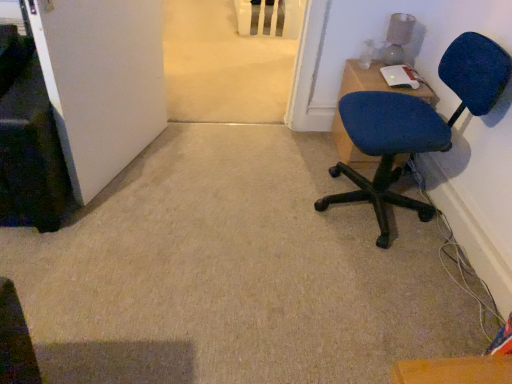
Where is `vacant point above blue fabric chair at upper right (from a real-world perspective)`? vacant point above blue fabric chair at upper right (from a real-world perspective) is located at coordinates (390, 75).